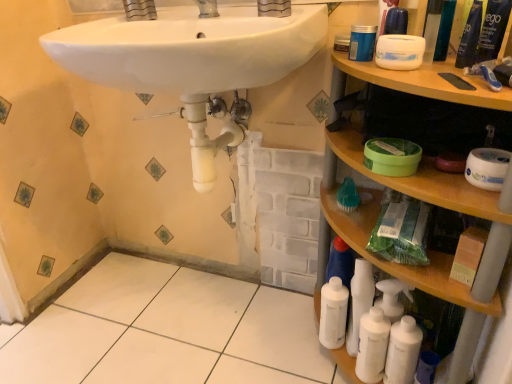
Where is `free space to the left of white matte toothpaste at upper right`? The height and width of the screenshot is (384, 512). free space to the left of white matte toothpaste at upper right is located at coordinates (422, 80).